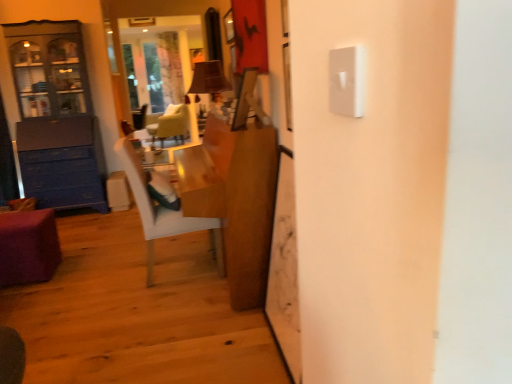
What do you see at coordinates (28, 247) in the screenshot? I see `purple fabric ottoman at lower left` at bounding box center [28, 247].

What do you see at coordinates (170, 124) in the screenshot? The image size is (512, 384). I see `light green fabric chair at center, acting as the 2th chair starting from the front` at bounding box center [170, 124].

The height and width of the screenshot is (384, 512). Describe the element at coordinates (54, 101) in the screenshot. I see `matte blue cabinet at left` at that location.

This screenshot has height=384, width=512. In order to click on white textured curtain at upper center in this screenshot , I will do `click(170, 68)`.

Is white textured curtain at upper center further to camera compared to light green fabric chair at center, the first chair in the back-to-front sequence?

Yes, white textured curtain at upper center is further from the viewer.

Can you tell me how much white textured curtain at upper center and light green fabric chair at center, which is counted as the 2th chair, starting from the right, differ in facing direction?

The facing directions of white textured curtain at upper center and light green fabric chair at center, which is counted as the 2th chair, starting from the right, are 52.9 degrees apart.

Which is more distant, [172,70] or [180,132]?

The point [172,70] is farther from the camera.

From a real-world perspective, is white textured curtain at upper center beneath light green fabric chair at center, the first chair from the left?

Actually, white textured curtain at upper center is physically above light green fabric chair at center, the first chair from the left, in the real world.

Which of these two, purple fabric ottoman at lower left or matte blue cabinet at left, is smaller?

With smaller size is purple fabric ottoman at lower left.

Is purple fabric ottoman at lower left wider or thinner than matte blue cabinet at left?

In the image, purple fabric ottoman at lower left appears to be more narrow than matte blue cabinet at left.

Between point (48, 244) and point (66, 62), which one is positioned in front?

Point (48, 244)

Considering the relative sizes of matte blue cabinet at left and white textured curtain at upper center in the image provided, is matte blue cabinet at left smaller than white textured curtain at upper center?

No, matte blue cabinet at left is not smaller than white textured curtain at upper center.

From the image's perspective, does matte blue cabinet at left appear lower than white textured curtain at upper center?

Correct, matte blue cabinet at left appears lower than white textured curtain at upper center in the image.

From the picture: Is matte blue cabinet at left next to white textured curtain at upper center?

No, matte blue cabinet at left is not next to white textured curtain at upper center.

Considering the relative sizes of white glossy chair at center, which is counted as the 1th chair, starting from the bottom, and wooden desk at center in the image provided, is white glossy chair at center, which is counted as the 1th chair, starting from the bottom, taller than wooden desk at center?

Incorrect, the height of white glossy chair at center, which is counted as the 1th chair, starting from the bottom, is not larger of that of wooden desk at center.

Who is bigger, white glossy chair at center, arranged as the 2th chair when viewed from the left, or wooden desk at center?

wooden desk at center is bigger.

Is white glossy chair at center, the first chair positioned from the right, positioned far away from wooden desk at center?

Actually, white glossy chair at center, the first chair positioned from the right, and wooden desk at center are a little close together.

The height and width of the screenshot is (384, 512). Identify the location of table lying on the right of white glossy chair at center, the first chair in the front-to-back sequence. (234, 200).

Looking at this image, which of these two, light green fabric chair at center, the first chair in the back-to-front sequence, or white glossy chair at center, the second chair viewed from the top, stands shorter?

light green fabric chair at center, the first chair in the back-to-front sequence.

How many degrees apart are the facing directions of light green fabric chair at center, the first chair from the left, and white glossy chair at center, the first chair in the front-to-back sequence?

The facing directions of light green fabric chair at center, the first chair from the left, and white glossy chair at center, the first chair in the front-to-back sequence, are 149 degrees apart.

Does light green fabric chair at center, the first chair in the back-to-front sequence, appear on the right side of white glossy chair at center, the first chair positioned from the right?

No.

Considering their positions, is light green fabric chair at center, the second chair when ordered from bottom to top, located in front of or behind white glossy chair at center, arranged as the 2th chair when viewed from the left?

Visually, light green fabric chair at center, the second chair when ordered from bottom to top, is located behind white glossy chair at center, arranged as the 2th chair when viewed from the left.

From a real-world perspective, is white glossy chair at center, the first chair positioned from the right, on purple fabric ottoman at lower left?

Correct, in the physical world, white glossy chair at center, the first chair positioned from the right, is higher than purple fabric ottoman at lower left.

Which of these two, white glossy chair at center, the first chair positioned from the right, or purple fabric ottoman at lower left, stands shorter?

With less height is purple fabric ottoman at lower left.

Does white glossy chair at center, acting as the 2th chair starting from the back, have a larger size compared to purple fabric ottoman at lower left?

Correct, white glossy chair at center, acting as the 2th chair starting from the back, is larger in size than purple fabric ottoman at lower left.

Considering the points (218, 237) and (8, 213), which point is behind, point (218, 237) or point (8, 213)?

Point (218, 237)

Considering the sizes of objects wooden desk at center and matte blue cabinet at left in the image provided, who is wider, wooden desk at center or matte blue cabinet at left?

Wider between the two is wooden desk at center.

Is wooden desk at center situated inside matte blue cabinet at left or outside?

wooden desk at center is located beyond the bounds of matte blue cabinet at left.

Which is behind, point (219, 194) or point (78, 118)?

Positioned behind is point (78, 118).

Starting from the white textured curtain at upper center, which chair is the 1st one in front? Please provide its 2D coordinates.

[(170, 124)]

Find the location of a particular element. cabinetry behind the purple fabric ottoman at lower left is located at coordinates (54, 101).

From the image, which object appears to be nearer to wooden desk at center, white glossy chair at center, the first chair in the front-to-back sequence, or white textured curtain at upper center?

white glossy chair at center, the first chair in the front-to-back sequence, is positioned closer to the anchor wooden desk at center.

From the image, which object appears to be farther from wooden desk at center, purple fabric ottoman at lower left or light green fabric chair at center, which ranks as the 1th chair in top-to-bottom order?

light green fabric chair at center, which ranks as the 1th chair in top-to-bottom order, is positioned further to the anchor wooden desk at center.

Estimate the real-world distances between objects in this image. Which object is closer to light green fabric chair at center, which ranks as the 1th chair in top-to-bottom order, purple fabric ottoman at lower left or wooden desk at center?

The object closer to light green fabric chair at center, which ranks as the 1th chair in top-to-bottom order, is purple fabric ottoman at lower left.

From the image, which object appears to be farther from purple fabric ottoman at lower left, white glossy chair at center, the first chair in the front-to-back sequence, or white textured curtain at upper center?

The object further to purple fabric ottoman at lower left is white textured curtain at upper center.

Looking at this image, when comparing their distances from purple fabric ottoman at lower left, does white glossy chair at center, the first chair in the front-to-back sequence, or light green fabric chair at center, the first chair in the back-to-front sequence, seem further?

light green fabric chair at center, the first chair in the back-to-front sequence, is positioned further to the anchor purple fabric ottoman at lower left.

From the image, which object appears to be farther from wooden desk at center, purple fabric ottoman at lower left or white glossy chair at center, which is counted as the 1th chair, starting from the bottom?

purple fabric ottoman at lower left is positioned further to the anchor wooden desk at center.

Looking at the image, which one is located further to light green fabric chair at center, the first chair in the back-to-front sequence, white glossy chair at center, acting as the 2th chair starting from the back, or white textured curtain at upper center?

Based on the image, white glossy chair at center, acting as the 2th chair starting from the back, appears to be further to light green fabric chair at center, the first chair in the back-to-front sequence.

Estimate the real-world distances between objects in this image. Which object is further from white glossy chair at center, the first chair positioned from the right, white textured curtain at upper center or purple fabric ottoman at lower left?

white textured curtain at upper center is positioned further to the anchor white glossy chair at center, the first chair positioned from the right.

Where is `cabinetry located between purple fabric ottoman at lower left and light green fabric chair at center, which is counted as the 2th chair, starting from the right, in the depth direction`? The image size is (512, 384). cabinetry located between purple fabric ottoman at lower left and light green fabric chair at center, which is counted as the 2th chair, starting from the right, in the depth direction is located at coordinates (54, 101).

Identify the location of chair positioned between wooden desk at center and light green fabric chair at center, the first chair in the back-to-front sequence, from near to far. (161, 212).

Identify the location of desk positioned between white glossy chair at center, acting as the 2th chair starting from the back, and light green fabric chair at center, acting as the 2th chair starting from the front, from near to far. (28, 247).

Locate an element on the screen. The height and width of the screenshot is (384, 512). cabinetry between wooden desk at center and white textured curtain at upper center along the z-axis is located at coordinates (54, 101).